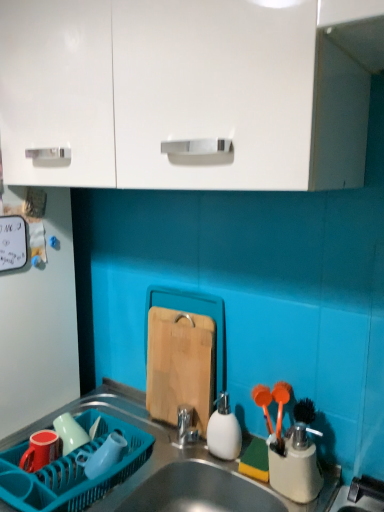
You are a GUI agent. You are given a task and a screenshot of the screen. Output one action in this format:
    pyautogui.click(x=<x>, y=<y>)
    Task: Click on the vacant point to the right of translucent blue plastic cup at lower left, positioned as the third tableware in left-to-right order
    Image resolution: width=384 pixels, height=512 pixels.
    Given the screenshot: What is the action you would take?
    pyautogui.click(x=158, y=464)